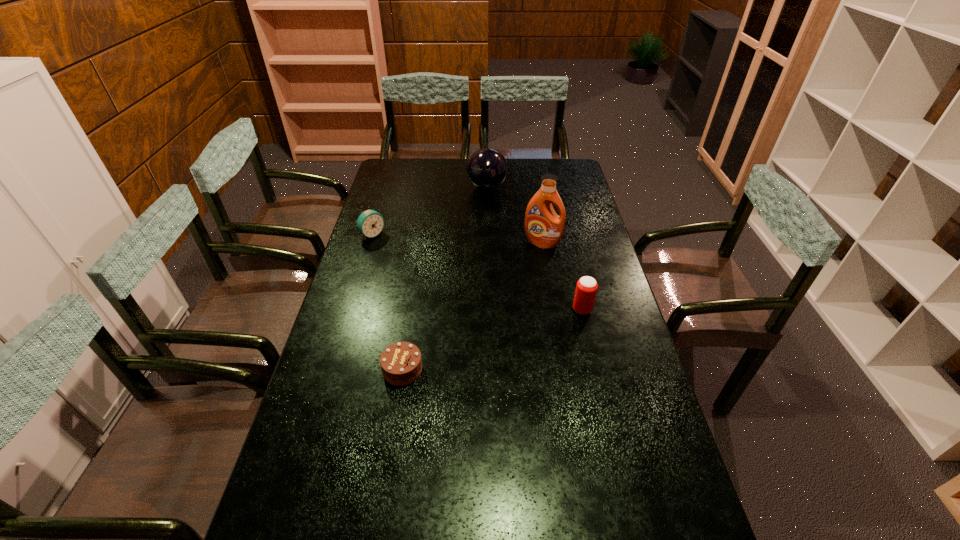
Where is `vacant area that satisfies the following two spatial constraints: 1. on the front side of the beer can; 2. on the left side of the tallest object`? The height and width of the screenshot is (540, 960). vacant area that satisfies the following two spatial constraints: 1. on the front side of the beer can; 2. on the left side of the tallest object is located at coordinates (554, 309).

Where is `blank space that satisfies the following two spatial constraints: 1. on the front side of the chocolate cake; 2. on the right side of the leftmost object`? blank space that satisfies the following two spatial constraints: 1. on the front side of the chocolate cake; 2. on the right side of the leftmost object is located at coordinates (332, 369).

Locate an element on the screen. The image size is (960, 540). vacant space that satisfies the following two spatial constraints: 1. on the front side of the leftmost object; 2. on the left side of the detergent is located at coordinates (371, 243).